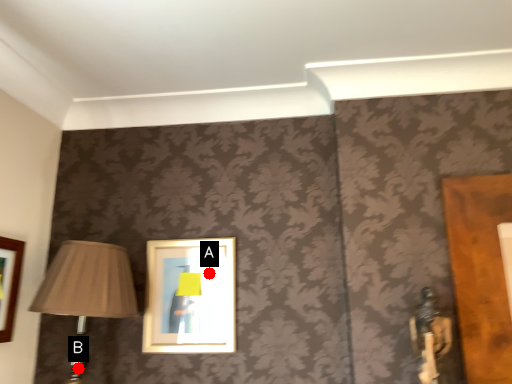
Question: Two points are circled on the image, labeled by A and B beside each circle. Which of the following is the closest to the observer?

Choices:
 (A) A is closer
 (B) B is closer

Answer: (B)